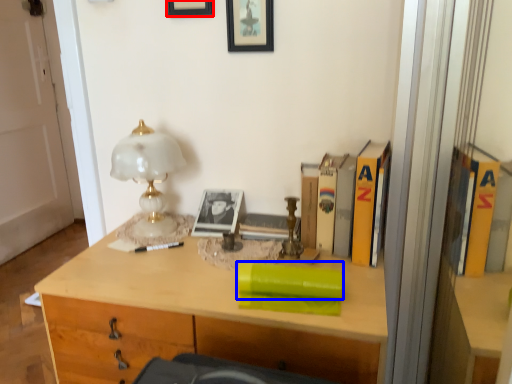
Question: Which object appears closest to the camera in this image, picture frame (highlighted by a red box) or book (highlighted by a blue box)?

Choices:
 (A) picture frame
 (B) book

Answer: (B)